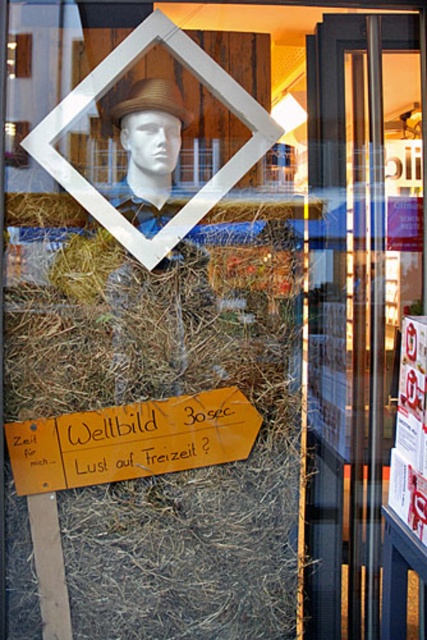
Which of these two, transparent glass door at right or brown straw hat at upper center, stands shorter?

brown straw hat at upper center is shorter.

Does transparent glass door at right appear over brown straw hat at upper center?

Actually, transparent glass door at right is below brown straw hat at upper center.

Image resolution: width=427 pixels, height=640 pixels. What do you see at coordinates (342, 336) in the screenshot? I see `transparent glass door at right` at bounding box center [342, 336].

This screenshot has height=640, width=427. Find the location of `transparent glass door at right`. transparent glass door at right is located at coordinates (342, 336).

Does wooden signboard at center have a greater width compared to matte brown hat at upper center?

Yes.

Is wooden signboard at center smaller than matte brown hat at upper center?

Yes, wooden signboard at center is smaller than matte brown hat at upper center.

Between point (237, 397) and point (181, 129), which one is positioned behind?

Positioned behind is point (181, 129).

Where is `wooden signboard at center`? The image size is (427, 640). wooden signboard at center is located at coordinates (152, 436).

Image resolution: width=427 pixels, height=640 pixels. What do you see at coordinates (342, 336) in the screenshot?
I see `transparent glass door at right` at bounding box center [342, 336].

Does point (362, 388) come farther from viewer compared to point (61, 451)?

Yes, it is behind point (61, 451).

Is point (365, 544) closer to viewer compared to point (183, 449)?

That is False.

Locate an element on the screen. This screenshot has height=640, width=427. transparent glass door at right is located at coordinates (342, 336).